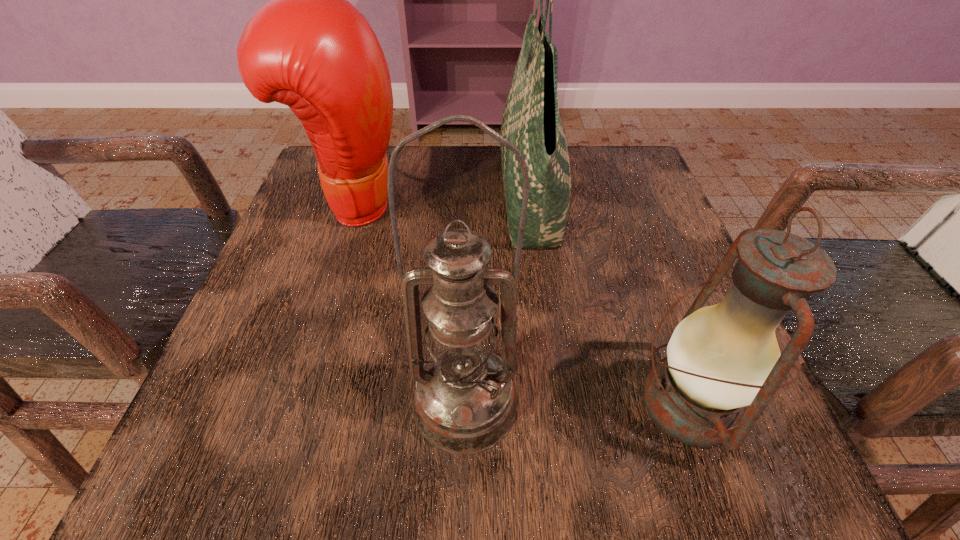
The image size is (960, 540). I want to click on boxing glove that is at the far edge, so click(x=309, y=48).

Find the location of a particular element. This screenshot has width=960, height=540. object present at the left edge is located at coordinates (309, 48).

You are a GUI agent. You are given a task and a screenshot of the screen. Output one action in this format:
    pyautogui.click(x=<x>, y=<y>)
    Task: Click on the object that is at the right edge
    This screenshot has height=540, width=960.
    Given the screenshot: What is the action you would take?
    pyautogui.click(x=721, y=358)

Locate an element on the screen. object that is at the far left corner is located at coordinates (309, 48).

The height and width of the screenshot is (540, 960). In order to click on object present at the near right corner in this screenshot , I will do `click(721, 358)`.

The height and width of the screenshot is (540, 960). In the image, there is a desktop. Identify the location of vacant space at the far edge. (479, 198).

This screenshot has height=540, width=960. I want to click on vacant region at the left edge of the desktop, so click(225, 364).

Find the location of `free space at the right edge`. free space at the right edge is located at coordinates (694, 279).

What are the coordinates of `vacant space at the far left corner of the desktop` in the screenshot? It's located at (320, 202).

Where is `free space at the near left corner of the desktop`? The height and width of the screenshot is (540, 960). free space at the near left corner of the desktop is located at coordinates (290, 415).